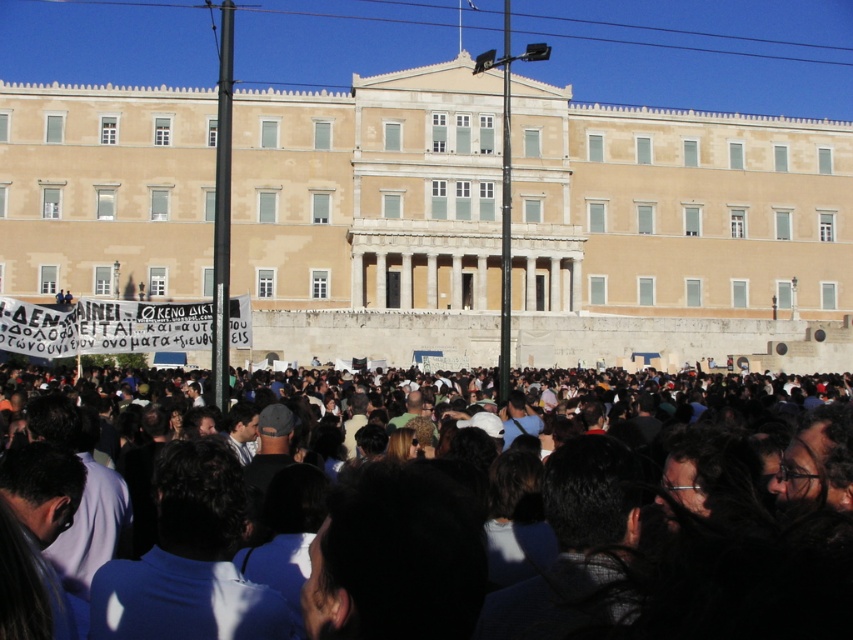
Does beige stone building at center have a larger size compared to dark brown hair at center?

Yes, beige stone building at center is bigger than dark brown hair at center.

Can you confirm if beige stone building at center is positioned below dark brown hair at center?

No, beige stone building at center is not below dark brown hair at center.

Does point (518, 166) come in front of point (189, 612)?

No.

The width and height of the screenshot is (853, 640). In order to click on beige stone building at center in this screenshot , I will do `click(677, 211)`.